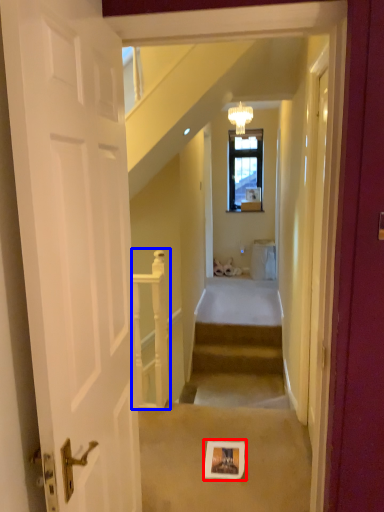
Question: Which object is closer to the camera taking this photo, picture frame (highlighted by a red box) or rail (highlighted by a blue box)?

Choices:
 (A) picture frame
 (B) rail

Answer: (A)